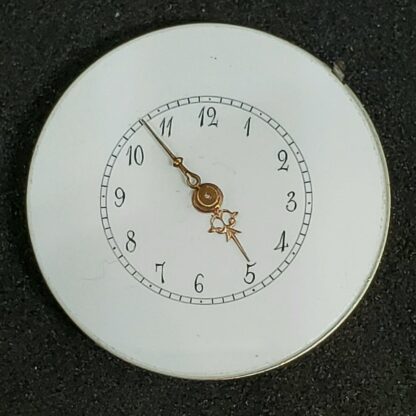
This screenshot has width=416, height=416. What are the coordinates of `clock` in the screenshot? It's located at (173, 244).